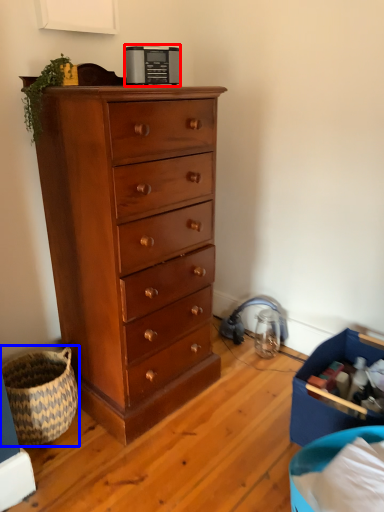
Question: Which of the following is the closest to the observer, appliance (highlighted by a red box) or basket (highlighted by a blue box)?

Choices:
 (A) appliance
 (B) basket

Answer: (B)